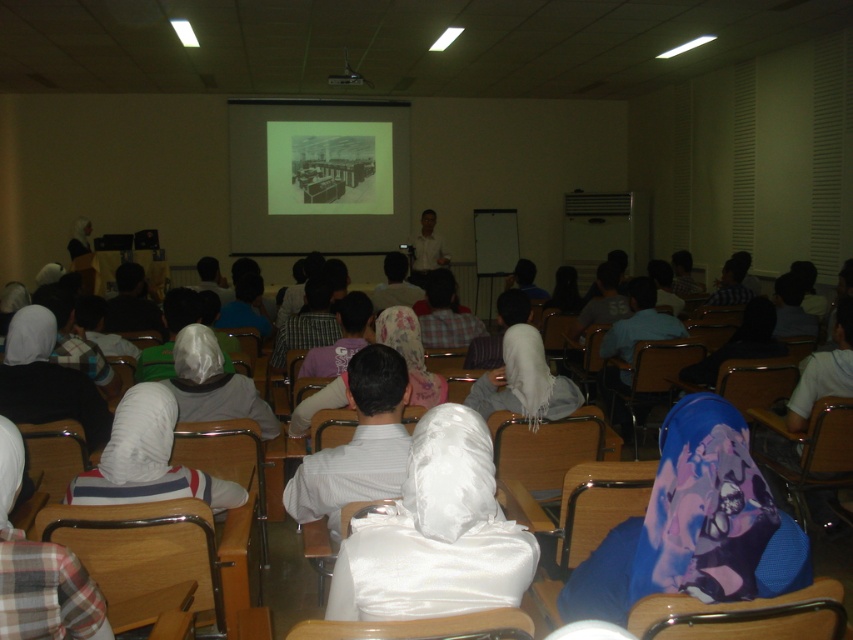
Question: Can you confirm if wooden chair at lower right is wider than dark fabric headscarf at center?

Choices:
 (A) yes
 (B) no

Answer: (B)

Question: Is black paper at center above wooden chair at lower left?

Choices:
 (A) yes
 (B) no

Answer: (A)

Question: Is dark fabric headscarf at center positioned at the back of black plastic projector at upper center?

Choices:
 (A) no
 (B) yes

Answer: (A)

Question: Which point is farther from the camera taking this photo?

Choices:
 (A) (759, 320)
 (B) (677, 493)
 (C) (221, 628)
 (D) (422, 227)

Answer: (D)

Question: Among these points, which one is farthest from the camera?

Choices:
 (A) (735, 529)
 (B) (349, 83)
 (C) (160, 470)
 (D) (434, 220)

Answer: (D)

Question: Which object is positioned farthest from the white satin hijab at center?

Choices:
 (A) black plastic projector at upper center
 (B) plaid fabric shirt at lower left

Answer: (A)